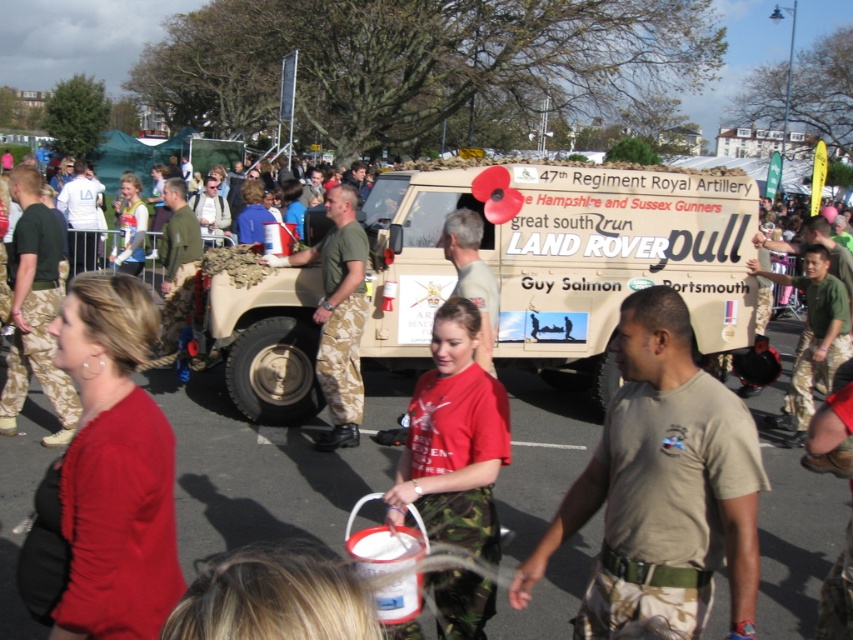
From the picture: Between tan matte land rover at center and camo-patterned pants at center, which one appears on the left side from the viewer's perspective?

camo-patterned pants at center is more to the left.

Is tan matte land rover at center taller than camo-patterned pants at center?

Yes, tan matte land rover at center is taller than camo-patterned pants at center.

Between point (387, 212) and point (433, 515), which one is positioned behind?

The point (387, 212) is behind.

Identify the location of tan matte land rover at center. Image resolution: width=853 pixels, height=640 pixels. (563, 262).

Is tan matte land rover at center taller than camouflage uniform at center?

Indeed, tan matte land rover at center has a greater height compared to camouflage uniform at center.

The image size is (853, 640). Identify the location of tan matte land rover at center. (563, 262).

The height and width of the screenshot is (640, 853). Identify the location of tan matte land rover at center. (563, 262).

Does camouflage uniform at center have a greater height compared to camo-patterned pants at center?

No.

The height and width of the screenshot is (640, 853). I want to click on camouflage uniform at center, so click(662, 484).